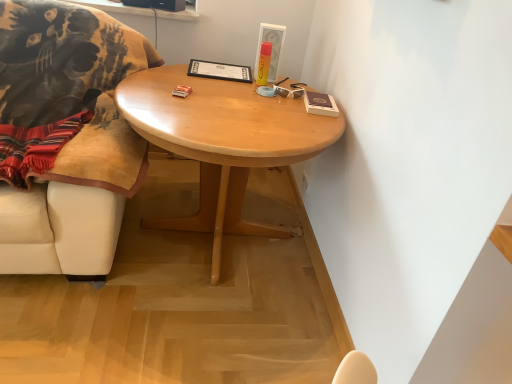
Describe the element at coordinates (222, 142) in the screenshot. This screenshot has width=512, height=384. I see `light wood/finish coffee table at center` at that location.

The image size is (512, 384). Find the location of `white plastic sunglasses at upper right`. white plastic sunglasses at upper right is located at coordinates (289, 90).

The height and width of the screenshot is (384, 512). Find the location of `velvet beige chair at left`. velvet beige chair at left is located at coordinates (72, 139).

Image resolution: width=512 pixels, height=384 pixels. I want to click on matte white picture frame at upper center, so click(x=272, y=47).

Which is less distant, (282, 32) or (82, 7)?

The point (82, 7) is more forward.

In the scene shown: Is matte white picture frame at upper center situated inside velvet beige chair at left or outside?

matte white picture frame at upper center is not enclosed by velvet beige chair at left.

Looking at their sizes, would you say matte white picture frame at upper center is wider or thinner than velvet beige chair at left?

Clearly, matte white picture frame at upper center has less width compared to velvet beige chair at left.

Looking at this image, how different are the orientations of light wood/finish coffee table at center and white plastic sunglasses at upper right in degrees?

There is a 5.64-degree angle between the facing directions of light wood/finish coffee table at center and white plastic sunglasses at upper right.

Looking at this image, is light wood/finish coffee table at center facing towards white plastic sunglasses at upper right?

No, light wood/finish coffee table at center is not facing towards white plastic sunglasses at upper right.

Considering the relative sizes of light wood/finish coffee table at center and white plastic sunglasses at upper right in the image provided, is light wood/finish coffee table at center smaller than white plastic sunglasses at upper right?

Actually, light wood/finish coffee table at center might be larger than white plastic sunglasses at upper right.

Is light wood/finish coffee table at center wider or thinner than white plastic sunglasses at upper right?

Considering their sizes, light wood/finish coffee table at center looks broader than white plastic sunglasses at upper right.

Which of these two, velvet beige chair at left or white plastic sunglasses at upper right, is wider?

With larger width is velvet beige chair at left.

Is point (121, 117) positioned in front of point (293, 95)?

Yes, point (121, 117) is in front of point (293, 95).

Is velvet beige chair at left oriented towards white plastic sunglasses at upper right?

No, velvet beige chair at left is not oriented towards white plastic sunglasses at upper right.

Between velvet beige chair at left and white plastic sunglasses at upper right, which one has larger size?

With larger size is velvet beige chair at left.

Considering the sizes of objects matte white picture frame at upper center and light wood/finish coffee table at center in the image provided, who is bigger, matte white picture frame at upper center or light wood/finish coffee table at center?

light wood/finish coffee table at center.

How many degrees apart are the facing directions of matte white picture frame at upper center and light wood/finish coffee table at center?

The facing directions of matte white picture frame at upper center and light wood/finish coffee table at center are 4.07 degrees apart.

Considering the points (275, 61) and (141, 131), which point is behind, point (275, 61) or point (141, 131)?

The point (275, 61) is farther from the camera.

In the scene shown: From a real-world perspective, is matte white picture frame at upper center physically located above or below light wood/finish coffee table at center?

In terms of real-world spatial position, matte white picture frame at upper center is above light wood/finish coffee table at center.

Are matte white picture frame at upper center and white plastic sunglasses at upper right located far from each other?

matte white picture frame at upper center is actually quite close to white plastic sunglasses at upper right.

Which is in front, point (261, 30) or point (290, 85)?

Positioned in front is point (290, 85).

Where is `glasses that is below the matte white picture frame at upper center (from the image's perspective)`? glasses that is below the matte white picture frame at upper center (from the image's perspective) is located at coordinates (289, 90).

Considering the positions of point (208, 138) and point (1, 269), is point (208, 138) closer or farther from the camera than point (1, 269)?

Point (208, 138) is closer to the camera than point (1, 269).

Who is shorter, light wood/finish coffee table at center or velvet beige chair at left?

light wood/finish coffee table at center.

Does light wood/finish coffee table at center come behind velvet beige chair at left?

Yes.

Is light wood/finish coffee table at center to the left or to the right of velvet beige chair at left in the image?

From the image, it's evident that light wood/finish coffee table at center is to the right of velvet beige chair at left.

At what (x,y) coordinates should I click in order to perform the action: click on picture frame on the right of light wood/finish coffee table at center. Please return your answer as a coordinate pair (x, y). The image size is (512, 384). Looking at the image, I should click on (272, 47).

From the image's perspective, between light wood/finish coffee table at center and matte white picture frame at upper center, who is located below?

light wood/finish coffee table at center.

Is light wood/finish coffee table at center behind matte white picture frame at upper center?

No.

Is light wood/finish coffee table at center to the left of matte white picture frame at upper center from the viewer's perspective?

Correct, you'll find light wood/finish coffee table at center to the left of matte white picture frame at upper center.

Where is `picture frame behind the velvet beige chair at left`? Image resolution: width=512 pixels, height=384 pixels. picture frame behind the velvet beige chair at left is located at coordinates (272, 47).

The image size is (512, 384). In order to click on coffee table on the left of the white plastic sunglasses at upper right in this screenshot , I will do `click(222, 142)`.

Considering their positions, is matte white picture frame at upper center positioned closer to velvet beige chair at left than light wood/finish coffee table at center?

The object closer to velvet beige chair at left is light wood/finish coffee table at center.

Considering their positions, is light wood/finish coffee table at center positioned closer to white plastic sunglasses at upper right than matte white picture frame at upper center?

matte white picture frame at upper center is closer to white plastic sunglasses at upper right.

From the picture: Based on their spatial positions, is velvet beige chair at left or white plastic sunglasses at upper right closer to matte white picture frame at upper center?

white plastic sunglasses at upper right is positioned closer to the anchor matte white picture frame at upper center.

Looking at the image, which one is located further to white plastic sunglasses at upper right, light wood/finish coffee table at center or velvet beige chair at left?

Based on the image, velvet beige chair at left appears to be further to white plastic sunglasses at upper right.

Considering their positions, is light wood/finish coffee table at center positioned further to matte white picture frame at upper center than white plastic sunglasses at upper right?

light wood/finish coffee table at center lies further to matte white picture frame at upper center than the other object.

Which object lies further to the anchor point matte white picture frame at upper center, white plastic sunglasses at upper right or light wood/finish coffee table at center?

light wood/finish coffee table at center.

Which object lies further to the anchor point matte white picture frame at upper center, white plastic sunglasses at upper right or velvet beige chair at left?

Based on the image, velvet beige chair at left appears to be further to matte white picture frame at upper center.

Estimate the real-world distances between objects in this image. Which object is further from velvet beige chair at left, white plastic sunglasses at upper right or light wood/finish coffee table at center?

white plastic sunglasses at upper right.

You are a GUI agent. You are given a task and a screenshot of the screen. Output one action in this format:
    pyautogui.click(x=<x>, y=<y>)
    Task: Click on the coffee table located between velvet beige chair at left and matte white picture frame at upper center in the left-right direction
    The width and height of the screenshot is (512, 384).
    Given the screenshot: What is the action you would take?
    pyautogui.click(x=222, y=142)

This screenshot has height=384, width=512. I want to click on glasses between light wood/finish coffee table at center and matte white picture frame at upper center along the z-axis, so click(289, 90).

I want to click on coffee table between velvet beige chair at left and white plastic sunglasses at upper right in the horizontal direction, so click(x=222, y=142).

Locate an element on the screen. The width and height of the screenshot is (512, 384). picture frame between velvet beige chair at left and white plastic sunglasses at upper right from left to right is located at coordinates (272, 47).